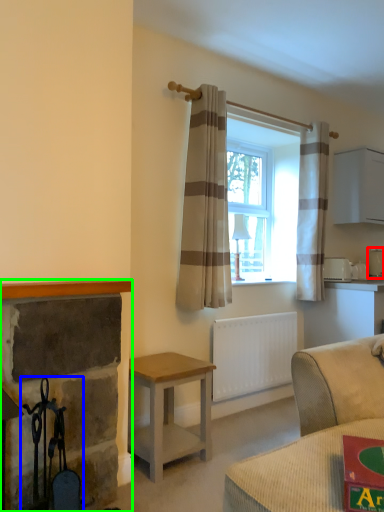
Question: Which object is the closest to the appliance (highlighted by a red box)? Choose among these: chair (highlighted by a blue box) or fireplace (highlighted by a green box).

Choices:
 (A) chair
 (B) fireplace

Answer: (B)